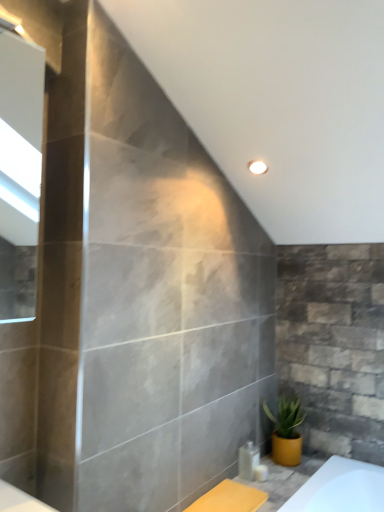
Question: From a real-world perspective, is clear plastic bottle at lower right, which is counted as the second toiletry, starting from the right, over white glossy soap dispenser at lower center, the 1th toiletry in the right-to-left sequence?

Choices:
 (A) no
 (B) yes

Answer: (B)

Question: Is clear plastic bottle at lower right, which is counted as the second toiletry, starting from the right, oriented towards white glossy soap dispenser at lower center, the 1th toiletry in the right-to-left sequence?

Choices:
 (A) yes
 (B) no

Answer: (A)

Question: From a real-world perspective, is clear plastic bottle at lower right, which is counted as the second toiletry, starting from the right, under white glossy soap dispenser at lower center, the 1th toiletry in the right-to-left sequence?

Choices:
 (A) yes
 (B) no

Answer: (B)

Question: Does clear plastic bottle at lower right, which is counted as the second toiletry, starting from the right, lie in front of white glossy soap dispenser at lower center, the 1th toiletry in the right-to-left sequence?

Choices:
 (A) no
 (B) yes

Answer: (A)

Question: Would you say clear plastic bottle at lower right, the 1th toiletry from the left, is a long distance from white glossy soap dispenser at lower center, which is the second toiletry in left-to-right order?

Choices:
 (A) yes
 (B) no

Answer: (B)

Question: From a real-world perspective, is clear plastic bottle at lower right, which is counted as the second toiletry, starting from the right, physically located above or below yellow matte pot at lower right?

Choices:
 (A) below
 (B) above

Answer: (A)

Question: Based on their positions, is clear plastic bottle at lower right, which is counted as the second toiletry, starting from the right, located to the left or right of yellow matte pot at lower right?

Choices:
 (A) right
 (B) left

Answer: (B)

Question: From the image's perspective, relative to yellow matte pot at lower right, is clear plastic bottle at lower right, which is counted as the second toiletry, starting from the right, above or below?

Choices:
 (A) below
 (B) above

Answer: (A)

Question: Considering the positions of clear plastic bottle at lower right, which is counted as the second toiletry, starting from the right, and yellow matte pot at lower right in the image, is clear plastic bottle at lower right, which is counted as the second toiletry, starting from the right, bigger or smaller than yellow matte pot at lower right?

Choices:
 (A) small
 (B) big

Answer: (A)

Question: Looking at their shapes, would you say white glossy soap dispenser at lower center, the 1th toiletry in the right-to-left sequence, is wider or thinner than clear plastic bottle at lower right, the 1th toiletry from the left?

Choices:
 (A) wide
 (B) thin

Answer: (B)

Question: From a real-world perspective, is white glossy soap dispenser at lower center, the 1th toiletry in the right-to-left sequence, above or below clear plastic bottle at lower right, which is counted as the second toiletry, starting from the right?

Choices:
 (A) above
 (B) below

Answer: (B)

Question: Is point (264, 464) closer or farther from the camera than point (258, 456)?

Choices:
 (A) closer
 (B) farther

Answer: (A)

Question: In the image, is white glossy soap dispenser at lower center, the 1th toiletry in the right-to-left sequence, positioned in front of or behind clear plastic bottle at lower right, the 1th toiletry from the left?

Choices:
 (A) front
 (B) behind

Answer: (A)

Question: Is clear plastic bottle at lower right, the 1th toiletry from the left, in front of or behind white glossy soap dispenser at lower center, the 1th toiletry in the right-to-left sequence, in the image?

Choices:
 (A) front
 (B) behind

Answer: (B)

Question: Considering the relative positions of clear plastic bottle at lower right, the 1th toiletry from the left, and white glossy soap dispenser at lower center, which is the second toiletry in left-to-right order, in the image provided, is clear plastic bottle at lower right, the 1th toiletry from the left, to the left or to the right of white glossy soap dispenser at lower center, which is the second toiletry in left-to-right order,?

Choices:
 (A) right
 (B) left

Answer: (B)